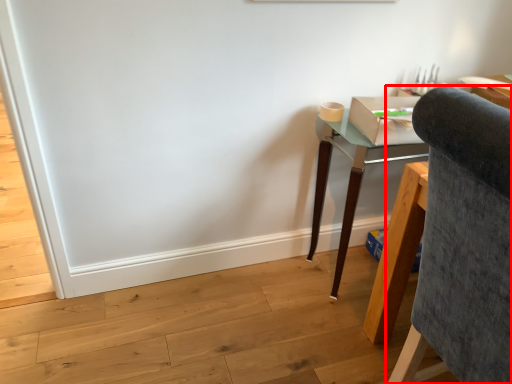
Question: From the image, what is the correct spatial relationship of chair (annotated by the red box) in relation to desk?

Choices:
 (A) left
 (B) right

Answer: (B)